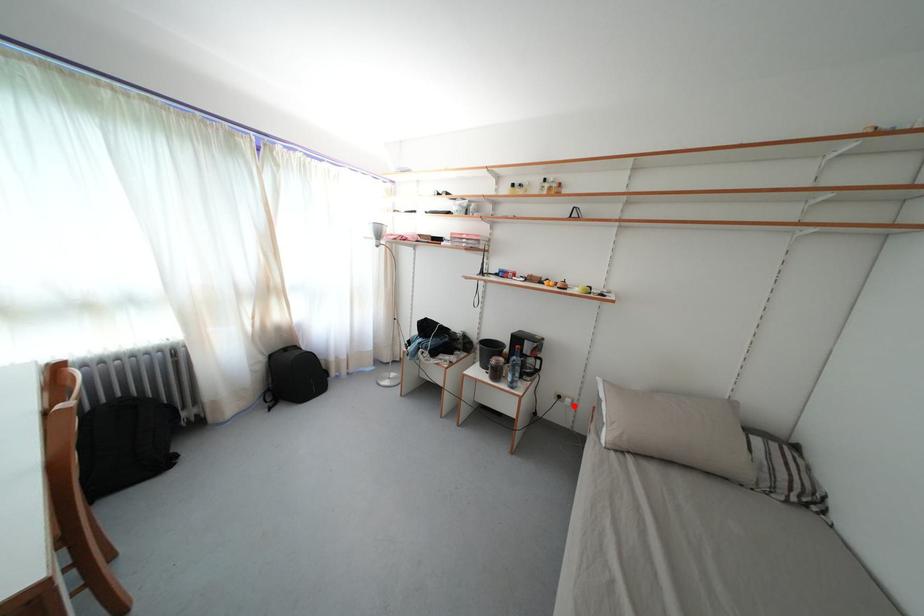
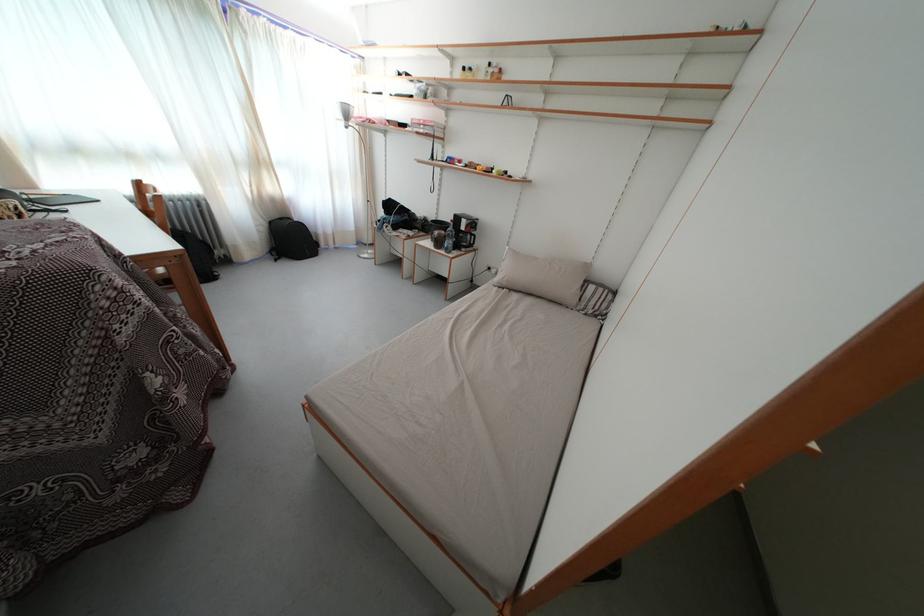
The point at the highlighted location is marked in the first image. Where is the corresponding point in the second image?

(500, 276)